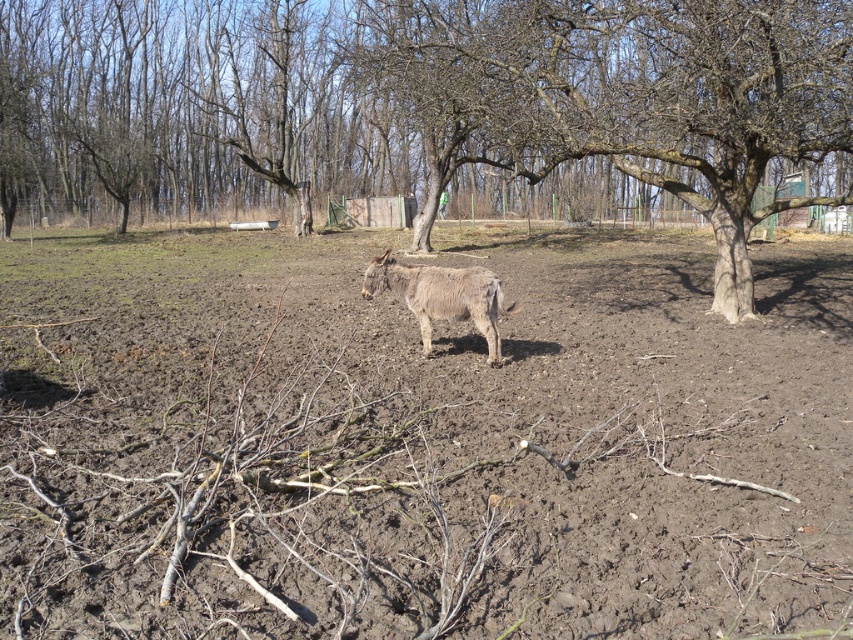
Based on the scene, which object occupies more horizontal space in the image? The brown soil at center or the bare bark tree at center?

The brown soil at center is wider than the bare bark tree at center, so the brown soil at center occupies more horizontal space.